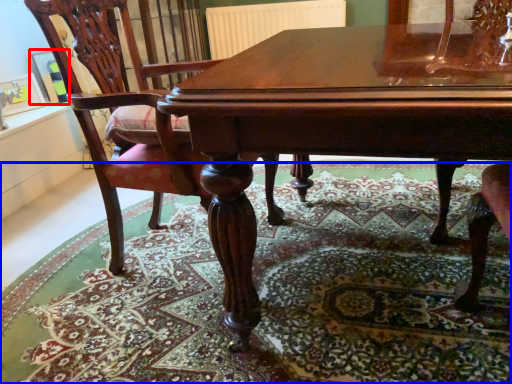
Question: Which of the following is the closest to the observer, picture frame (highlighted by a red box) or mat (highlighted by a blue box)?

Choices:
 (A) picture frame
 (B) mat

Answer: (B)